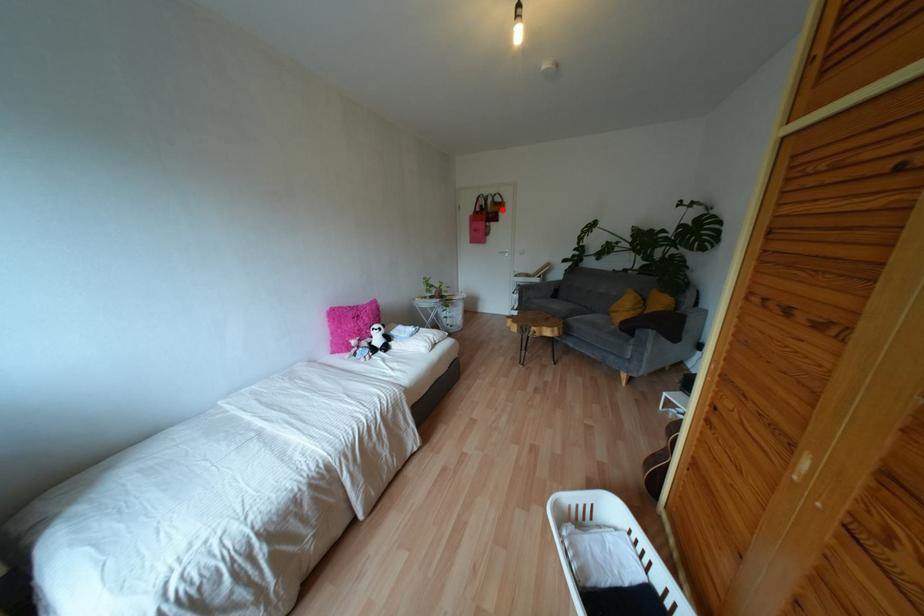
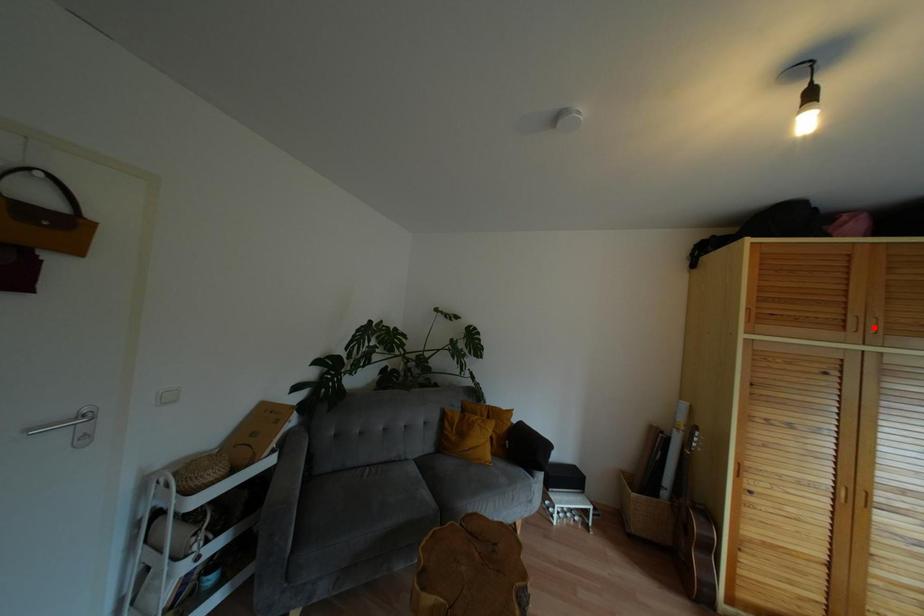
I am providing you with two images of the same scene from different viewpoints. A red point is marked on the first image and another point is marked on the second image. Does the point marked in image1 correspond to the same location as the one in image2?

No